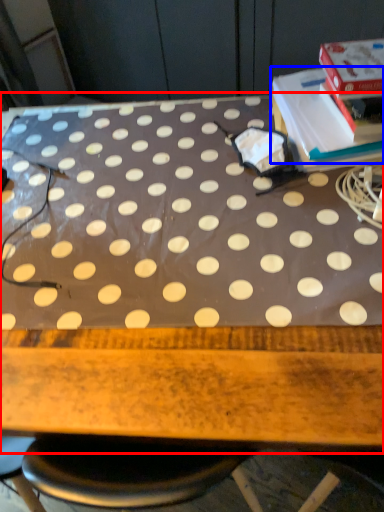
Question: Which of the following is the farthest to the observer, table (highlighted by a red box) or paperback book (highlighted by a blue box)?

Choices:
 (A) table
 (B) paperback book

Answer: (B)